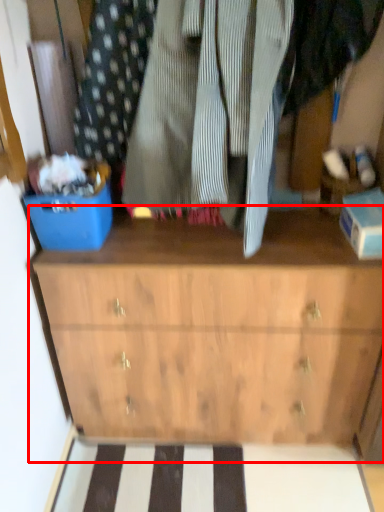
Question: Where is chest of drawers (annotated by the red box) located in relation to storage box in the image?

Choices:
 (A) left
 (B) right

Answer: (B)